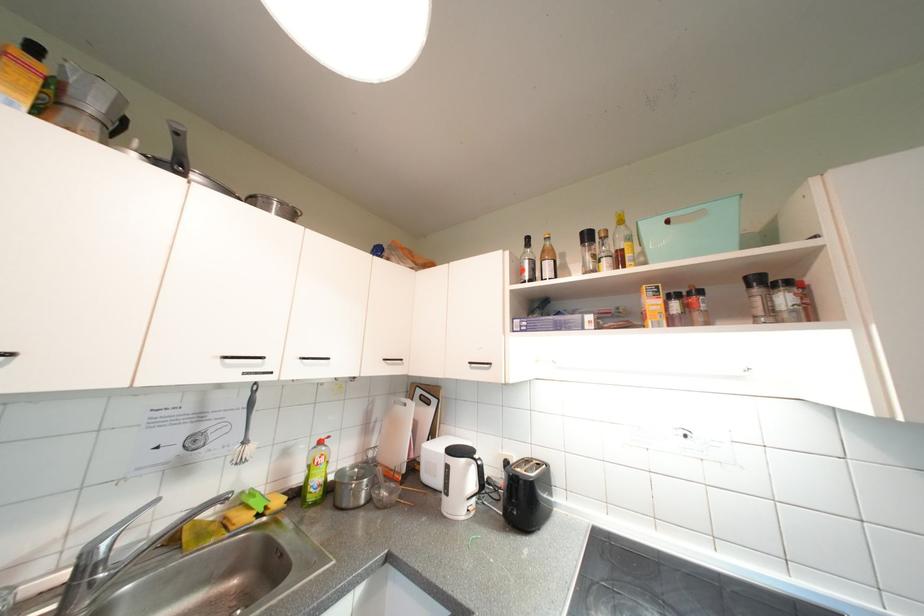
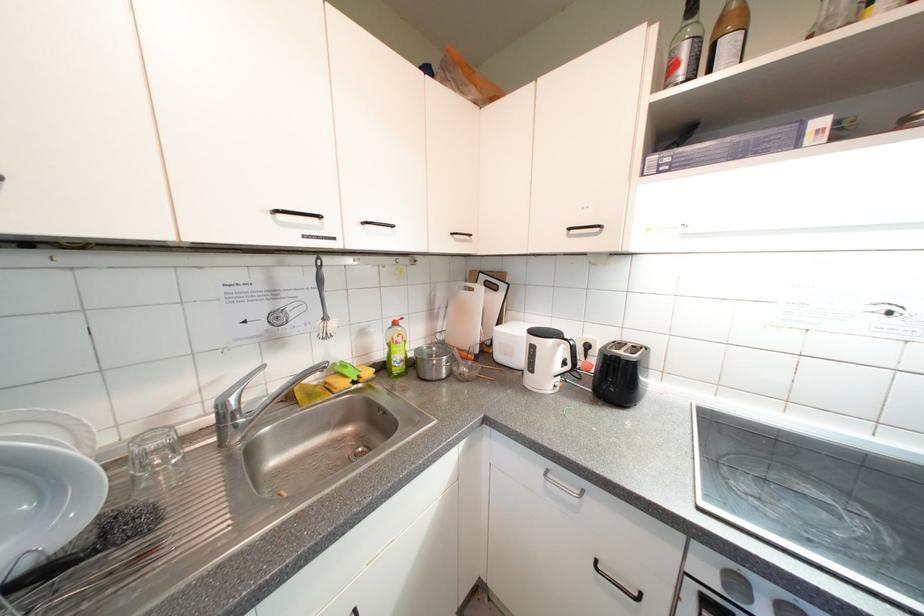
Locate, in the second image, the point that corresponds to pixel 234 360 in the first image.

(285, 214)